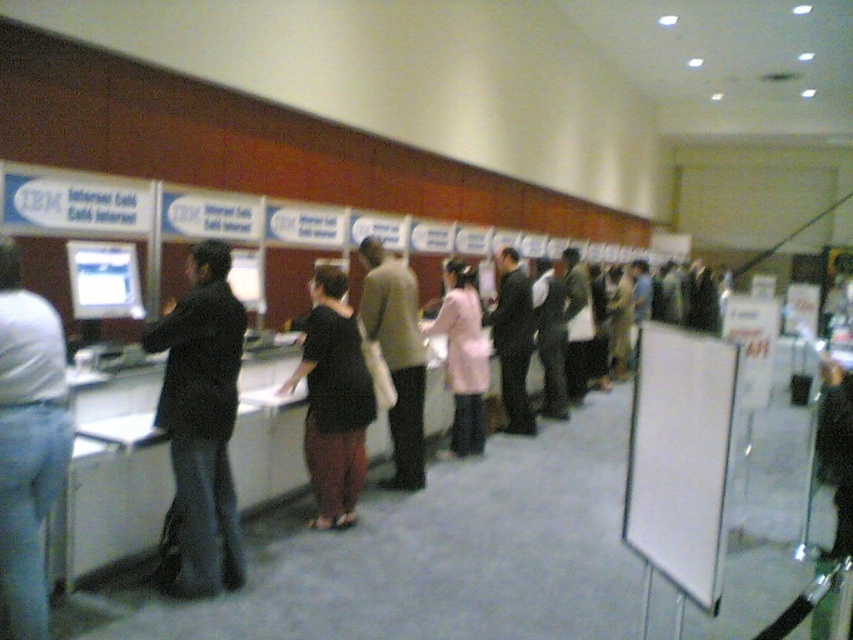
Which of these two, denim jeans at left or pink fabric coat at center, stands taller?

With more height is pink fabric coat at center.

Where is `denim jeans at left`? denim jeans at left is located at coordinates (28, 444).

Image resolution: width=853 pixels, height=640 pixels. What do you see at coordinates (28, 444) in the screenshot?
I see `denim jeans at left` at bounding box center [28, 444].

This screenshot has width=853, height=640. Identify the location of denim jeans at left. tap(28, 444).

Based on the photo, can you confirm if matte black desk at left is taller than dark gray suit at center?

No, matte black desk at left is not taller than dark gray suit at center.

Which is more to the right, matte black desk at left or dark gray suit at center?

Positioned to the right is dark gray suit at center.

Who is more forward, [102,564] or [560,419]?

Point [102,564] is more forward.

You are a GUI agent. You are given a task and a screenshot of the screen. Output one action in this format:
    pyautogui.click(x=<x>, y=<y>)
    Task: Click on the matte black desk at left
    Image resolution: width=853 pixels, height=640 pixels.
    Given the screenshot: What is the action you would take?
    click(114, 480)

From the picture: Is dark blue jeans at center further to the viewer compared to dark gray suit at center?

No, it is in front of dark gray suit at center.

Which of these two, dark blue jeans at center or dark gray suit at center, stands shorter?

dark blue jeans at center

What do you see at coordinates (201, 424) in the screenshot? I see `dark blue jeans at center` at bounding box center [201, 424].

Find the location of a particular element. dark blue jeans at center is located at coordinates (201, 424).